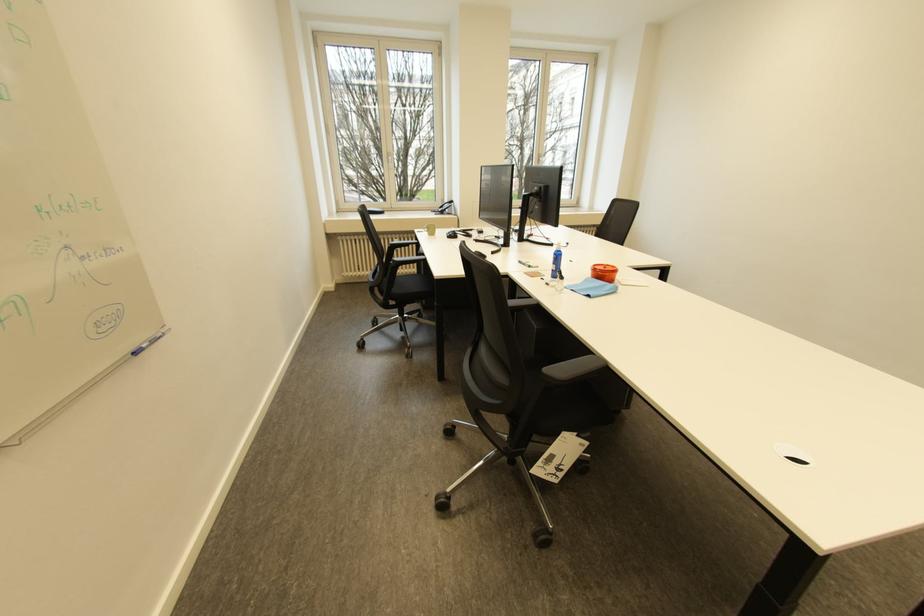
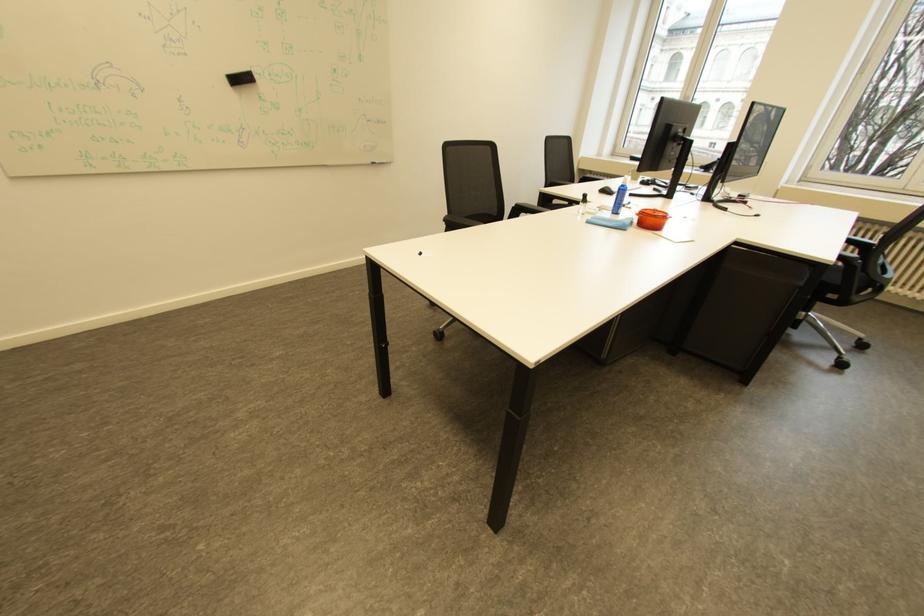
Question: I am providing you with two images of the same scene from different viewpoints. Which of the following objects are not visible in image2?

Choices:
 (A) blue cleaning cloth
 (B) blue spray bottle
 (C) phone handset
 (D) brown candle jar

Answer: (C)